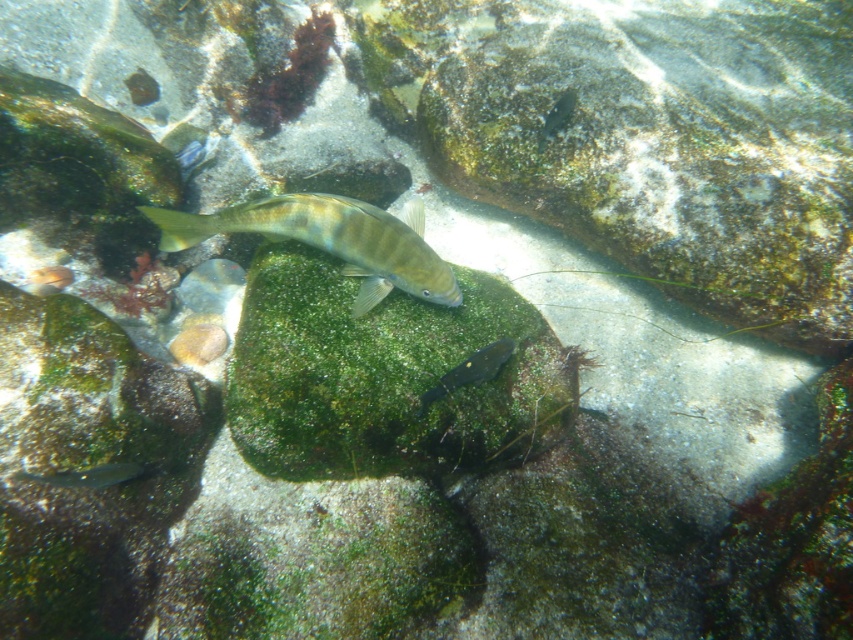
Question: Which point is farther from the camera taking this photo?

Choices:
 (A) (85, 468)
 (B) (347, 218)
 (C) (483, 356)

Answer: (B)

Question: Does greenish-yellow translucent fish at center appear under shiny silver fish at center?

Choices:
 (A) no
 (B) yes

Answer: (A)

Question: Which object is closer to the camera taking this photo?

Choices:
 (A) shiny silver fish at lower left
 (B) greenish-yellow translucent fish at center

Answer: (A)

Question: Does shiny silver fish at center have a larger size compared to shiny silver fish at lower left?

Choices:
 (A) yes
 (B) no

Answer: (A)

Question: Does greenish-yellow translucent fish at center appear on the left side of shiny silver fish at center?

Choices:
 (A) no
 (B) yes

Answer: (B)

Question: Which of the following is the farthest from the observer?

Choices:
 (A) greenish-yellow translucent fish at center
 (B) shiny silver fish at lower left
 (C) shiny silver fish at center

Answer: (A)